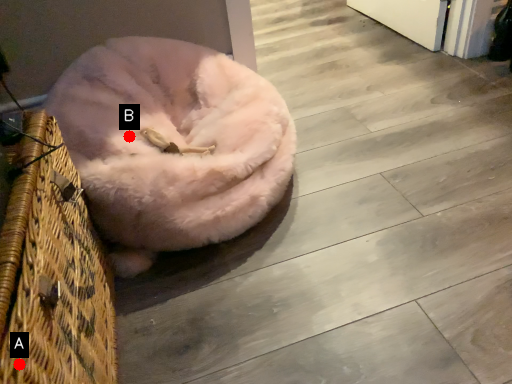
Question: Two points are circled on the image, labeled by A and B beside each circle. Which point is closer to the camera?

Choices:
 (A) A is closer
 (B) B is closer

Answer: (A)